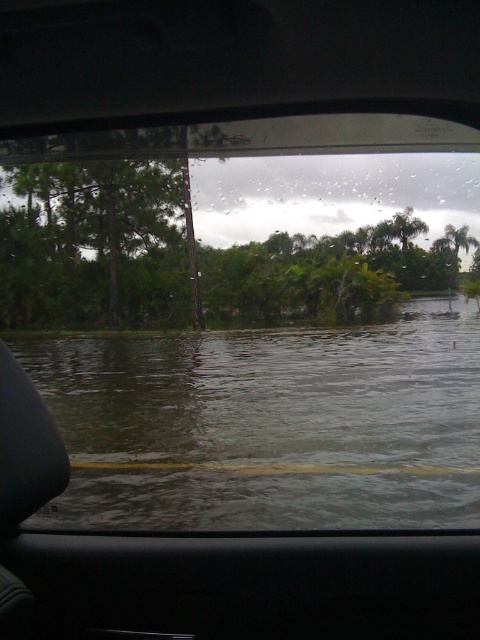
Is clear water at lower center to the left of green leafy tree at left from the viewer's perspective?

In fact, clear water at lower center is to the right of green leafy tree at left.

Does clear water at lower center have a lesser height compared to green leafy tree at left?

No.

Where is `clear water at lower center`? The image size is (480, 640). clear water at lower center is located at coordinates (267, 426).

Who is lower down, clear water at lower center or green leafy tree at center?

Positioned lower is clear water at lower center.

Is clear water at lower center taller than green leafy tree at center?

Incorrect, clear water at lower center's height is not larger of green leafy tree at center's.

Measure the distance between clear water at lower center and camera.

clear water at lower center is 5.55 meters from camera.

Identify the location of clear water at lower center. (267, 426).

Does point (156, 285) come behind point (25, 268)?

Yes, point (156, 285) is farther from viewer.

Between point (148, 300) and point (101, 321), which one is positioned in front?

Point (148, 300) is in front.

Who is more forward, (x=37, y=218) or (x=118, y=250)?

Point (x=37, y=218)

Identify the location of green leafy tree at center. (93, 244).